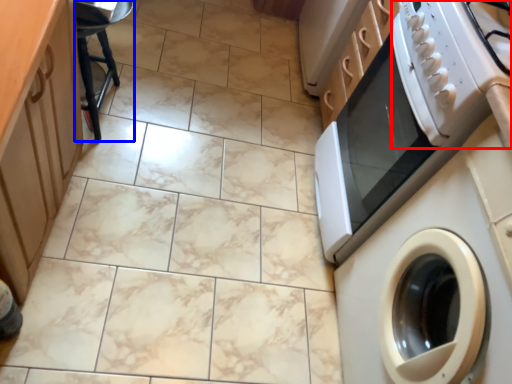
Question: Among these objects, which one is farthest to the camera, gas stove (highlighted by a red box) or bar stool (highlighted by a blue box)?

Choices:
 (A) gas stove
 (B) bar stool

Answer: (B)